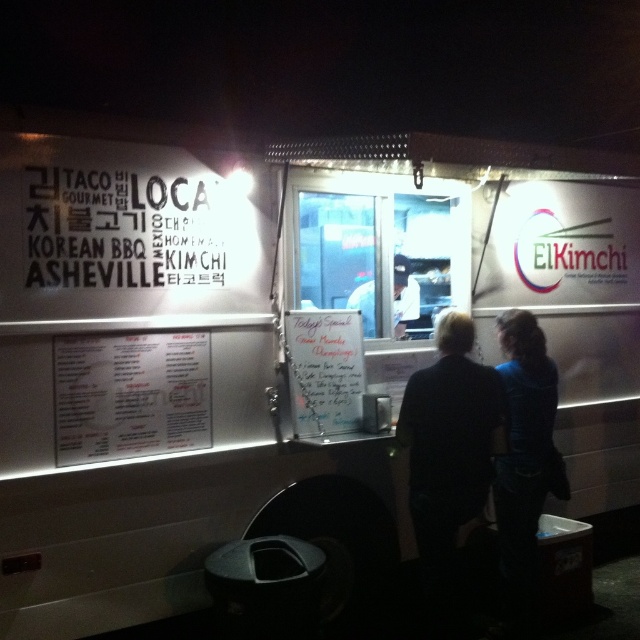
Is dark fabric shirt at center closer to camera compared to white fabric shirt at center?

Yes.

Measure the distance from dark fabric shirt at center to white fabric shirt at center.

dark fabric shirt at center is 1.05 meters from white fabric shirt at center.

Is point (444, 353) closer to camera compared to point (403, 269)?

Yes.

Locate an element on the screen. dark fabric shirt at center is located at coordinates (449, 458).

I want to click on white paper menu at center, so click(131, 396).

Locate an element on the screen. white paper menu at center is located at coordinates (131, 396).

Locate an element on the screen. The height and width of the screenshot is (640, 640). white paper menu at center is located at coordinates (131, 396).

Between dark fabric shirt at center and white paper menu at center, which one appears on the left side from the viewer's perspective?

From the viewer's perspective, white paper menu at center appears more on the left side.

Consider the image. Is dark fabric shirt at center smaller than white paper menu at center?

No, dark fabric shirt at center is not smaller than white paper menu at center.

What do you see at coordinates (449, 458) in the screenshot?
I see `dark fabric shirt at center` at bounding box center [449, 458].

Locate an element on the screen. dark fabric shirt at center is located at coordinates (449, 458).